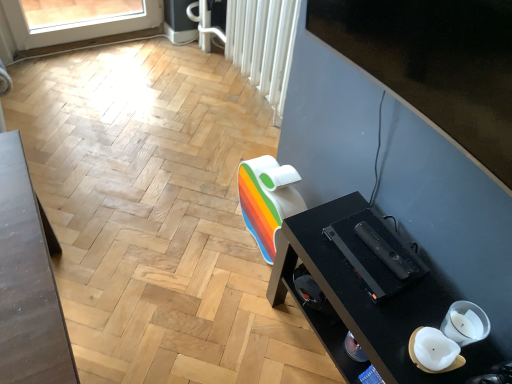
Question: Considering the relative sizes of black glossy desk at lower right and white textured radiator at upper center in the image provided, is black glossy desk at lower right taller than white textured radiator at upper center?

Choices:
 (A) yes
 (B) no

Answer: (B)

Question: Is black glossy desk at lower right turned away from white textured radiator at upper center?

Choices:
 (A) yes
 (B) no

Answer: (B)

Question: From the image's perspective, is black glossy desk at lower right below white textured radiator at upper center?

Choices:
 (A) no
 (B) yes

Answer: (B)

Question: From the image's perspective, is black glossy desk at lower right located above white textured radiator at upper center?

Choices:
 (A) no
 (B) yes

Answer: (A)

Question: Is black glossy desk at lower right bigger than white textured radiator at upper center?

Choices:
 (A) yes
 (B) no

Answer: (A)

Question: Looking at the image, does black glossy desk at lower right seem bigger or smaller compared to white textured radiator at upper center?

Choices:
 (A) big
 (B) small

Answer: (A)

Question: From the image's perspective, is black glossy desk at lower right located above or below white textured radiator at upper center?

Choices:
 (A) below
 (B) above

Answer: (A)

Question: Is point (394, 336) positioned closer to the camera than point (292, 21)?

Choices:
 (A) farther
 (B) closer

Answer: (B)

Question: Is black glossy desk at lower right wider or thinner than white textured radiator at upper center?

Choices:
 (A) thin
 (B) wide

Answer: (B)

Question: Is black glossy tv at upper right inside the boundaries of white textured radiator at upper center, or outside?

Choices:
 (A) outside
 (B) inside

Answer: (A)

Question: Considering their positions, is black glossy tv at upper right located in front of or behind white textured radiator at upper center?

Choices:
 (A) front
 (B) behind

Answer: (A)

Question: From the image's perspective, is black glossy tv at upper right above or below white textured radiator at upper center?

Choices:
 (A) below
 (B) above

Answer: (A)

Question: In terms of size, does black glossy tv at upper right appear bigger or smaller than white textured radiator at upper center?

Choices:
 (A) small
 (B) big

Answer: (A)

Question: Choose the correct answer: Is white textured radiator at upper center inside black glossy tv at upper right or outside it?

Choices:
 (A) outside
 (B) inside

Answer: (A)

Question: From the image's perspective, is white textured radiator at upper center above or below black glossy tv at upper right?

Choices:
 (A) above
 (B) below

Answer: (A)